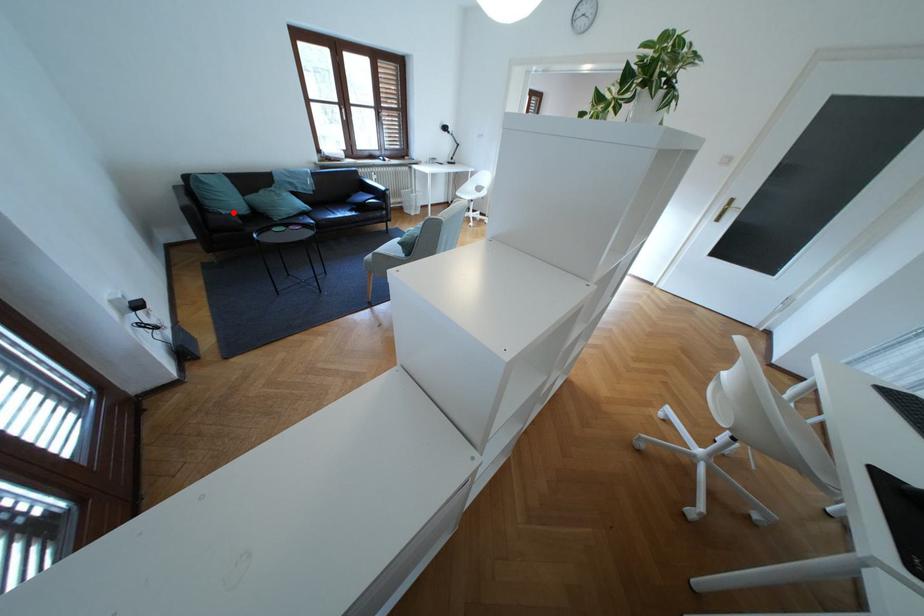
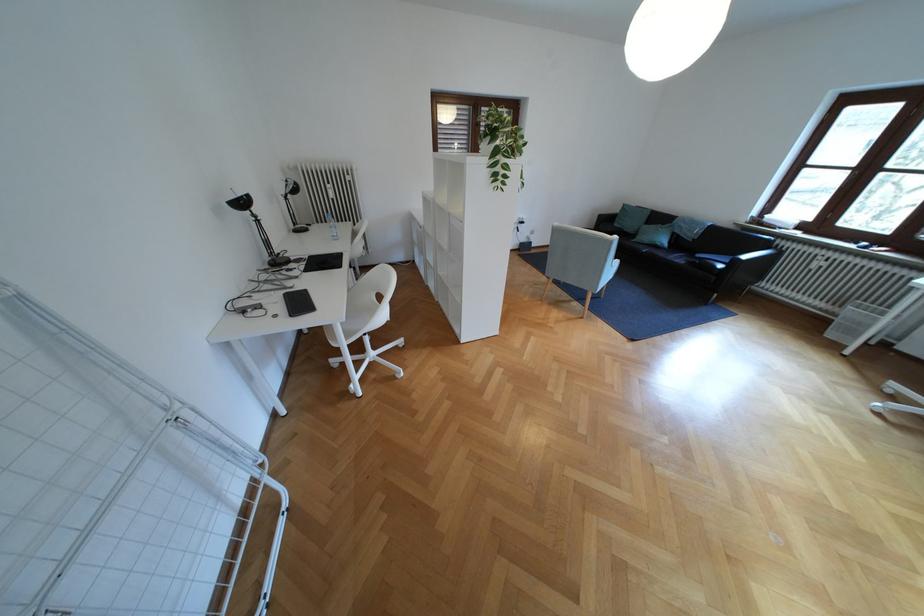
Locate, in the second image, the point that corresponds to the highlighted location in the first image.

(626, 225)